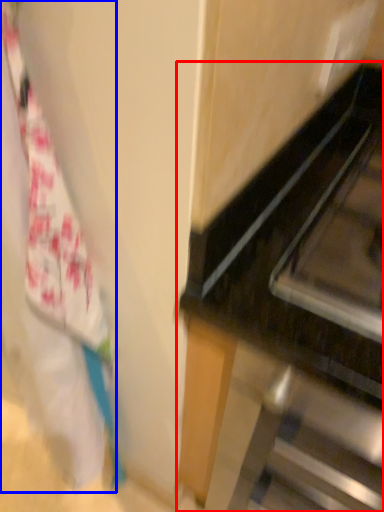
Question: Which point is closer to the camera, furniture (highlighted by a red box) or laundry (highlighted by a blue box)?

Choices:
 (A) furniture
 (B) laundry

Answer: (B)